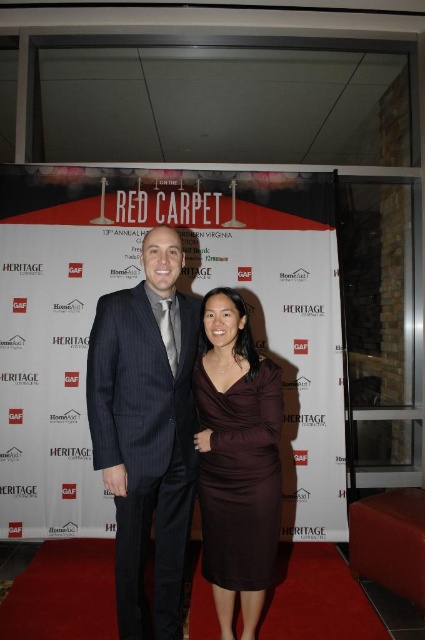
You are standing on the red carpet at the Heritage Northern Virginia Grand Auction. There are two points marked on the carpet. One is at coordinate point (172, 538) and the other is at point (282, 416). If you are facing the stage, which point is closer to the stage?

Point (282, 416) is closer to the stage because it is in front of point (172, 538).

You are a photographer at the event and need to position two subjects for a group photo. The subjects are wearing the dark blue pinstripe suit at center and the burgundy satin dress at center. Since you want to ensure proper framing, which subject should you place closer to the camera to maintain balance in the composition?

The dark blue pinstripe suit at center is larger in size than the burgundy satin dress at center. To maintain balance, the photographer should place the smaller burgundy satin dress at center closer to the camera so that its apparent size matches the larger dark blue pinstripe suit at center in the frame.